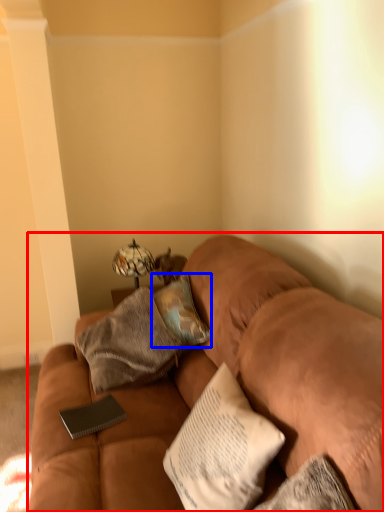
Question: Which object appears farthest to the camera in this image, studio couch (highlighted by a red box) or pillow (highlighted by a blue box)?

Choices:
 (A) studio couch
 (B) pillow

Answer: (B)